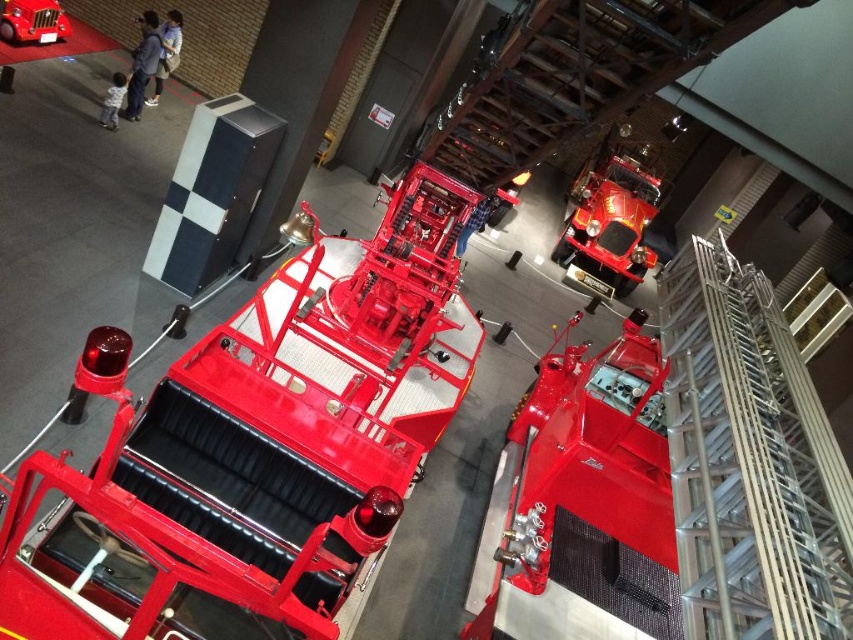
You are standing in the museum and want to take a photo of both points. Which point is closer to you, point (x=335, y=426) or point (x=637, y=230)?

Point (x=335, y=426) is closer to the viewer than point (x=637, y=230).

You are a visitor standing in front of the museum exhibit. You see the metallic silver ladder at center right and the glossy red fire truck at upper right. Which object is located below the other?

The metallic silver ladder at center right is positioned under the glossy red fire truck at upper right.